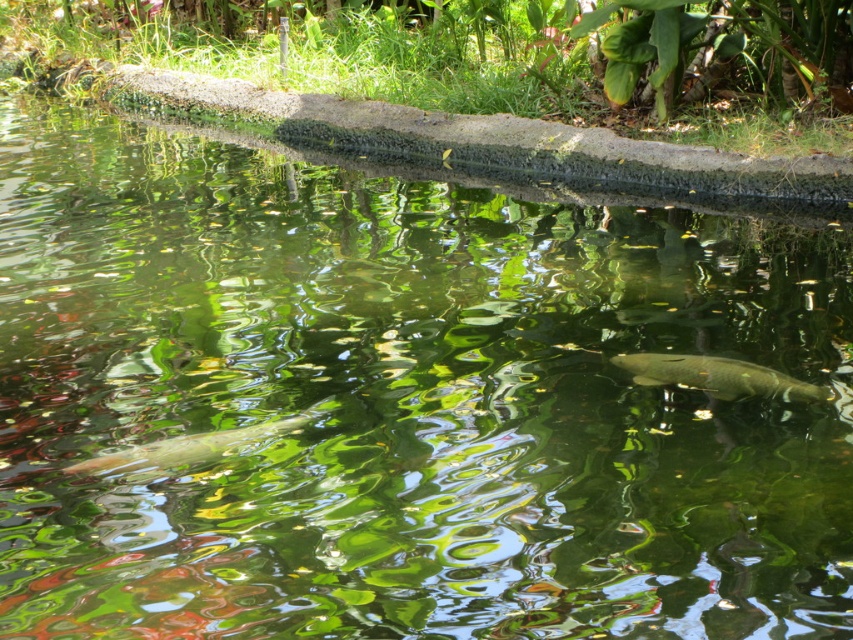
Between green matte fish at center and shiny silver fish at lower left, which one has less height?

shiny silver fish at lower left is shorter.

Who is taller, green matte fish at center or shiny silver fish at lower left?

green matte fish at center is taller.

Does point (633, 381) come farther from viewer compared to point (293, 420)?

Yes, point (633, 381) is behind point (293, 420).

You are a GUI agent. You are given a task and a screenshot of the screen. Output one action in this format:
    pyautogui.click(x=<x>, y=<y>)
    Task: Click on the green matte fish at center
    This screenshot has height=640, width=853.
    Given the screenshot: What is the action you would take?
    click(718, 376)